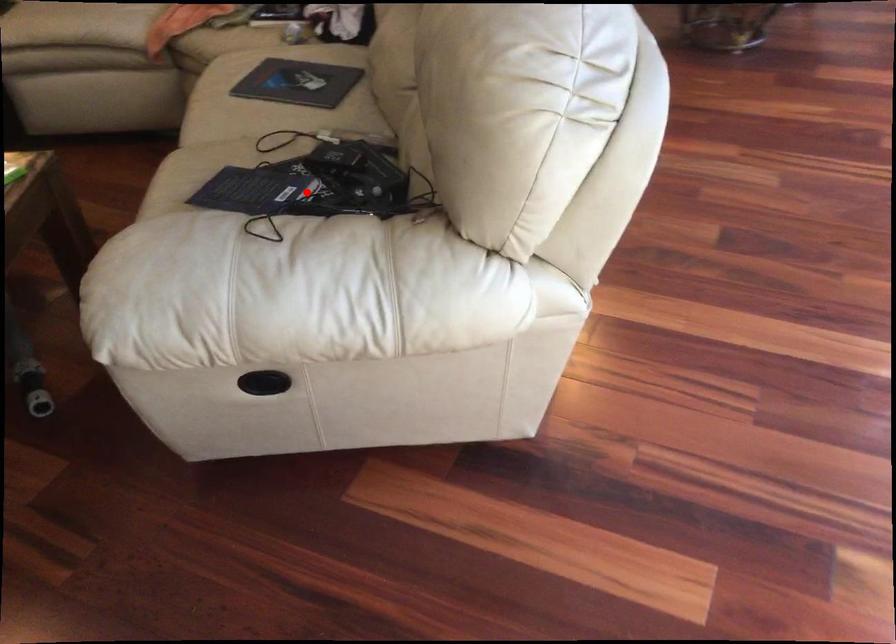
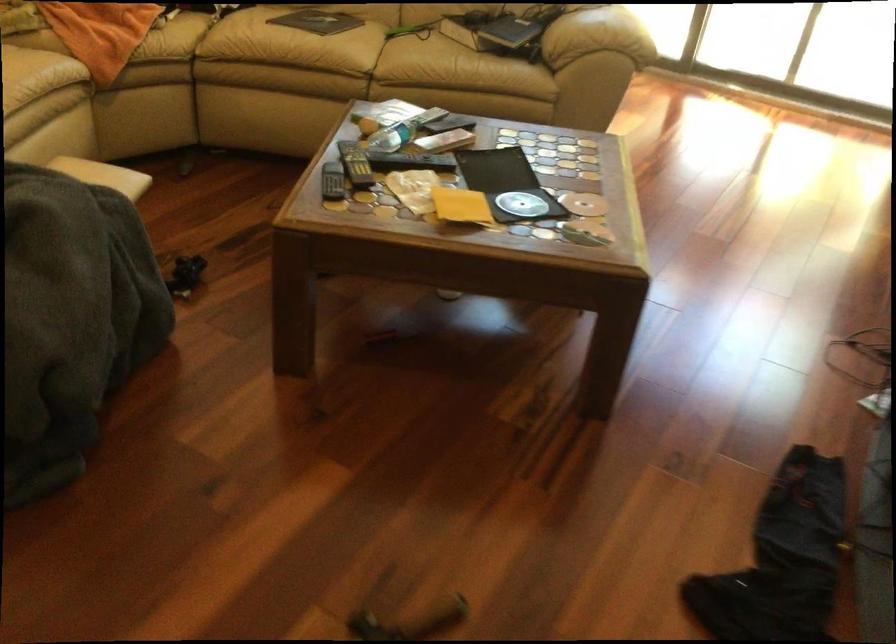
Question: I am providing you with two images of the same scene from different viewpoints. Given a red point in image1, look at the same physical point in image2. Is it:

Choices:
 (A) Closer to the viewpoint
 (B) Farther from the viewpoint

Answer: (B)